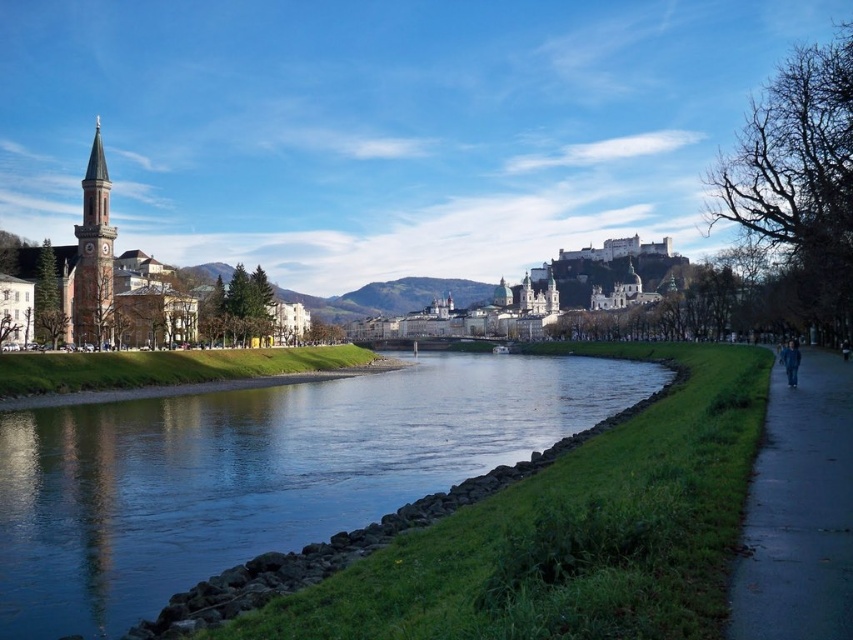
Between dark asphalt sidewalk at right and blue fabric jacket at lower right, which one is positioned lower?

Positioned lower is dark asphalt sidewalk at right.

Can you confirm if dark asphalt sidewalk at right is positioned below blue fabric jacket at lower right?

Indeed, dark asphalt sidewalk at right is positioned under blue fabric jacket at lower right.

Between point (798, 589) and point (790, 356), which one is positioned in front?

Point (798, 589)

This screenshot has height=640, width=853. Find the location of `dark asphalt sidewalk at right`. dark asphalt sidewalk at right is located at coordinates (799, 512).

Consider the image. Who is more distant from viewer, (494, 378) or (785, 374)?

The point (494, 378) is more distant.

Where is `blue water at center`? This screenshot has width=853, height=640. blue water at center is located at coordinates (259, 472).

Which is in front, point (38, 413) or point (790, 374)?

Point (790, 374) is more forward.

I want to click on blue water at center, so click(x=259, y=472).

Is point (560, 378) positioned behind point (747, 560)?

Yes, it is.

Who is positioned more to the left, blue water at center or dark asphalt sidewalk at right?

Positioned to the left is blue water at center.

I want to click on blue water at center, so click(259, 472).

Find the location of `blue water at center`. blue water at center is located at coordinates (259, 472).